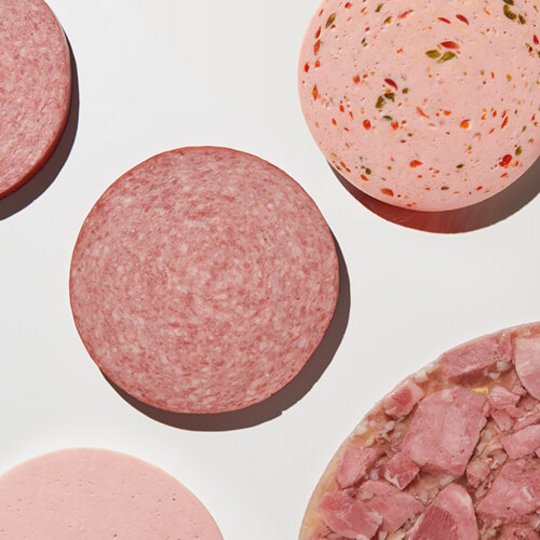
Identify the location of counter. (57, 407), (415, 297), (260, 471), (183, 75).